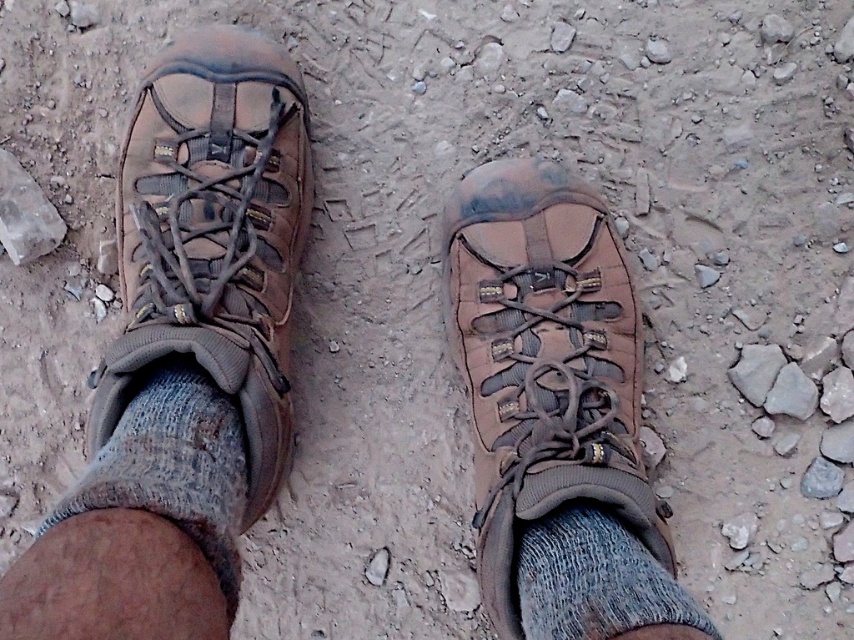
Find the location of a particular element. matte brown hiking boot at left is located at coordinates (214, 236).

Is matte brown hiking boot at left above gray knitted sock at lower center?

Indeed, matte brown hiking boot at left is positioned over gray knitted sock at lower center.

Measure the distance between matte brown hiking boot at left and camera.

matte brown hiking boot at left and camera are 3.37 feet apart from each other.

Image resolution: width=854 pixels, height=640 pixels. Find the location of `matte brown hiking boot at left`. matte brown hiking boot at left is located at coordinates (214, 236).

Can you confirm if matte brown hiking boot at left is shorter than gray knitted sock at lower left?

No.

Does point (255, 96) come in front of point (185, 384)?

No, (255, 96) is behind (185, 384).

Where is `matte brown hiking boot at left`? matte brown hiking boot at left is located at coordinates (214, 236).

Does matte brown hiking boot at left appear over gray rock at center?

Indeed, matte brown hiking boot at left is positioned over gray rock at center.

The image size is (854, 640). What do you see at coordinates (214, 236) in the screenshot?
I see `matte brown hiking boot at left` at bounding box center [214, 236].

This screenshot has width=854, height=640. Describe the element at coordinates (214, 236) in the screenshot. I see `matte brown hiking boot at left` at that location.

You are a GUI agent. You are given a task and a screenshot of the screen. Output one action in this format:
    pyautogui.click(x=<x>, y=<y>)
    Task: Click on the matte brown hiking boot at left
    This screenshot has height=640, width=854.
    Given the screenshot: What is the action you would take?
    pyautogui.click(x=214, y=236)